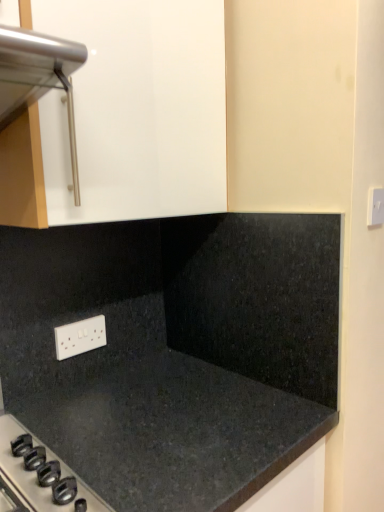
Question: From the image's perspective, relative to white plastic electric outlet at upper right, placed as the second electric outlet when sorted from bottom to top, is black granite countertop at lower left above or below?

Choices:
 (A) above
 (B) below

Answer: (B)

Question: Visually, is black granite countertop at lower left positioned to the left or to the right of white plastic electric outlet at upper right, marked as the second electric outlet in a back-to-front arrangement?

Choices:
 (A) right
 (B) left

Answer: (B)

Question: Which of these objects is positioned farthest from the white plastic electric outlet at upper right, which is the first electric outlet in right-to-left order?

Choices:
 (A) black granite countertop at lower left
 (B) white plastic electric outlet at lower left, placed as the second electric outlet when sorted from top to bottom

Answer: (B)

Question: Which is nearer to the white plastic electric outlet at lower left, placed as the second electric outlet when sorted from top to bottom?

Choices:
 (A) white plastic electric outlet at upper right, marked as the second electric outlet in a back-to-front arrangement
 (B) black granite countertop at lower left

Answer: (B)